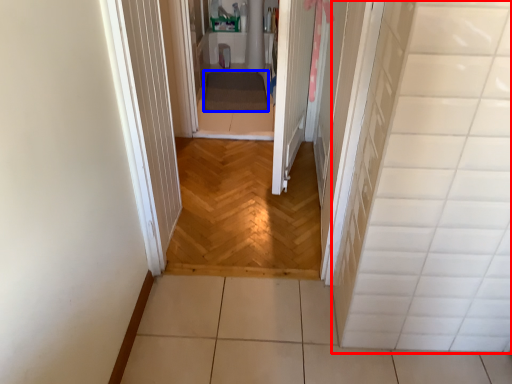
Question: Which object is closer to the camera taking this photo, tile (highlighted by a red box) or blanket (highlighted by a blue box)?

Choices:
 (A) tile
 (B) blanket

Answer: (A)